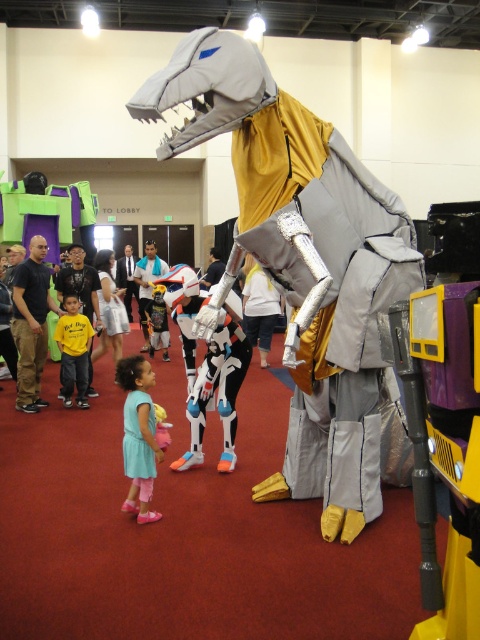
You are a photographer at this event and want to take a photo that includes both the yellow matte shirt at center and the white matte costume at center. Which one should you focus on first to ensure both are in focus?

The yellow matte shirt at center is closer to the viewer than the white matte costume at center, so focusing on the yellow matte shirt at center first will ensure both are in focus.

You are a photographer at the event and need to capture a photo that includes both the yellow matte shirt at center and the white matte costume at center. Which object should you focus on first to ensure both are in frame?

The yellow matte shirt at center has a smaller size compared to white matte costume at center, so you should focus on the white matte costume at center first to ensure both are in frame.

You are a photographer at the event and need to capture both the light blue fabric dress at center and the plush yellow costume at center in a single frame. Given that your camera has a fixed focal length, which object should you position closer to the camera to ensure both fit within the frame?

Since the light blue fabric dress at center is narrower than the plush yellow costume at center, positioning the plush yellow costume at center closer to the camera will help it appear larger in the frame, allowing both objects to fit within the camera view.